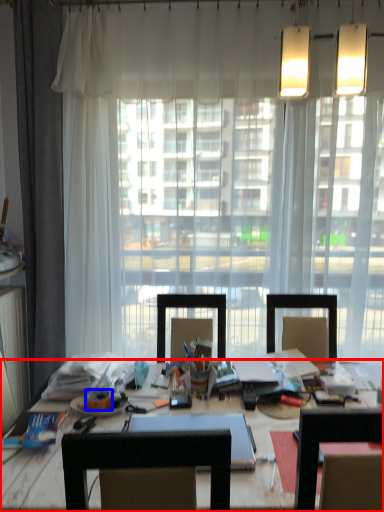
Question: Which object is closer to the camera taking this photo, desk (highlighted by a red box) or adhesive tape (highlighted by a blue box)?

Choices:
 (A) desk
 (B) adhesive tape

Answer: (A)